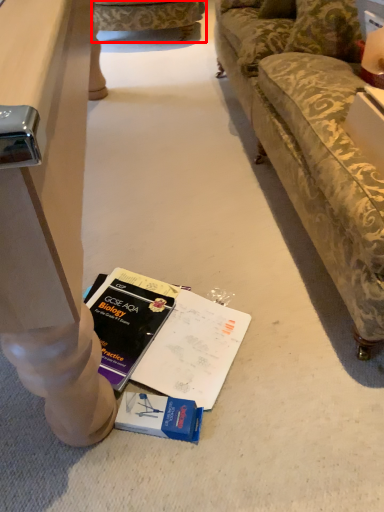
Question: From the image, what is the correct spatial relationship of studio couch (annotated by the red box) in relation to pillow?

Choices:
 (A) right
 (B) left

Answer: (B)